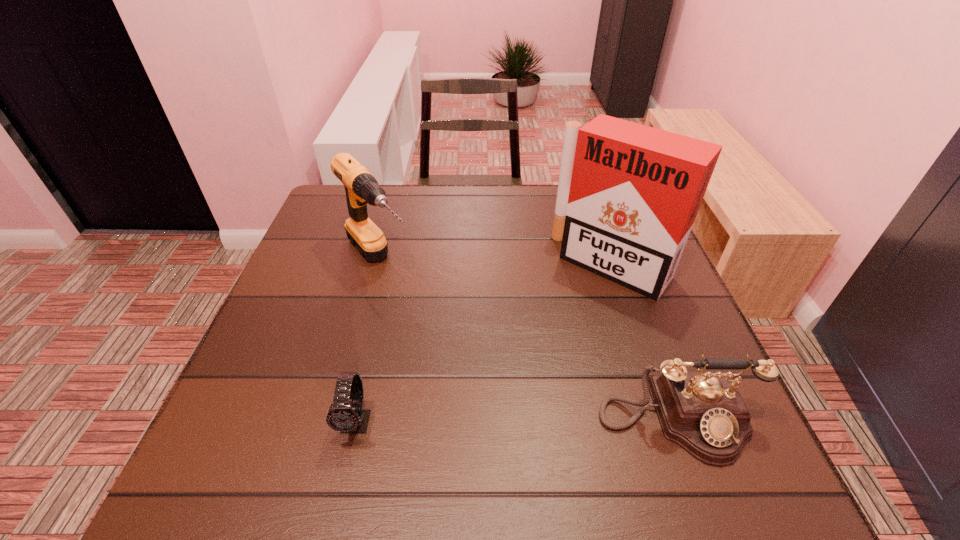
Where is `object at the far edge`? The width and height of the screenshot is (960, 540). object at the far edge is located at coordinates (361, 188).

I want to click on watch that is at the near edge, so click(x=347, y=418).

I want to click on telephone at the near edge, so click(703, 412).

The width and height of the screenshot is (960, 540). Identify the location of object present at the left edge. (361, 188).

This screenshot has width=960, height=540. Find the location of `telephone located at the right edge`. telephone located at the right edge is located at coordinates (703, 412).

Image resolution: width=960 pixels, height=540 pixels. Find the location of `cigarette case present at the right edge`. cigarette case present at the right edge is located at coordinates (628, 194).

At what (x,y) coordinates should I click in order to perform the action: click on object at the far left corner. Please return your answer as a coordinate pair (x, y). Image resolution: width=960 pixels, height=540 pixels. Looking at the image, I should click on (361, 188).

Find the location of a particular element. The image size is (960, 540). object that is at the near right corner is located at coordinates (703, 412).

Locate an element on the screen. The image size is (960, 540). vacant space at the far edge of the desktop is located at coordinates (548, 188).

This screenshot has height=540, width=960. What are the coordinates of `free location at the near edge` in the screenshot? It's located at (568, 433).